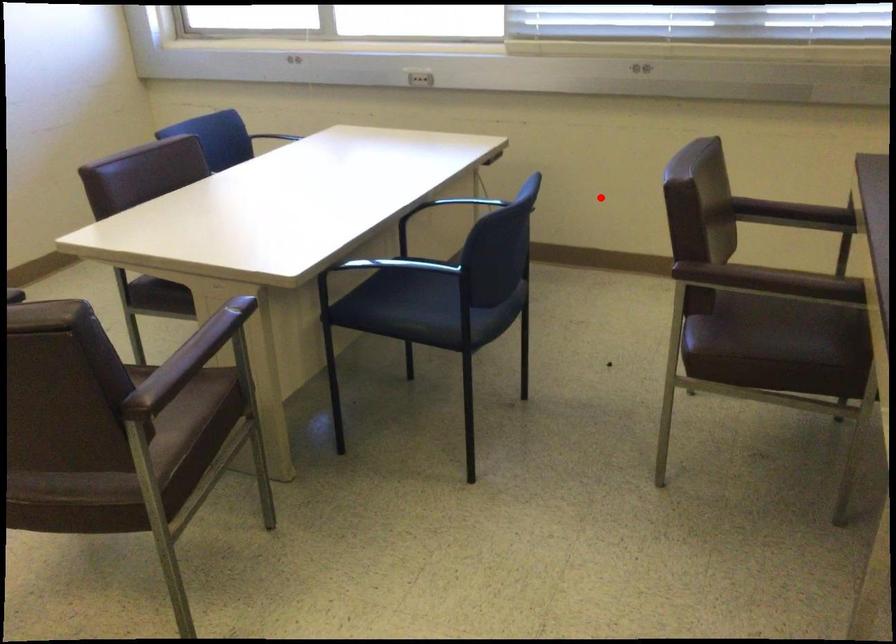
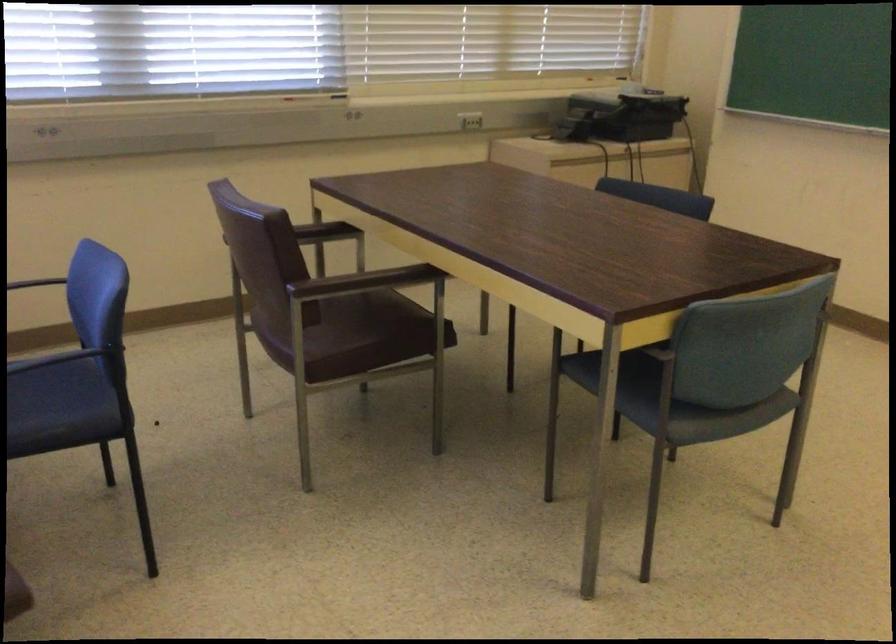
Find the pixel in the second image that matches the highlighted location in the first image.

(39, 283)